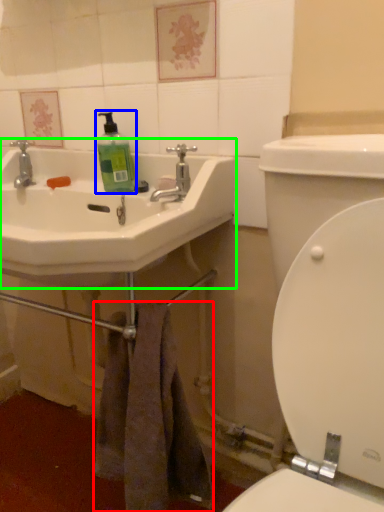
Question: Which is farther away from towel/napkin (highlighted by a red box)? cleaning product (highlighted by a blue box) or sink (highlighted by a green box)?

Choices:
 (A) cleaning product
 (B) sink

Answer: (A)